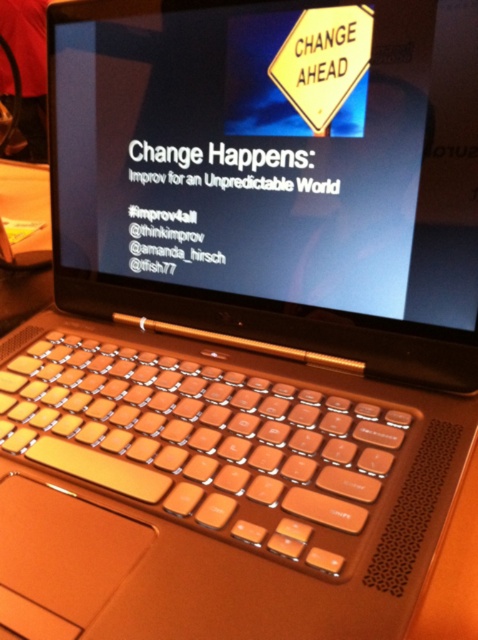
Consider the image. Which is more to the right, matte black laptop at center or orange plastic keyboard at center?

matte black laptop at center is more to the right.

Locate an element on the screen. The width and height of the screenshot is (478, 640). matte black laptop at center is located at coordinates (273, 152).

What do you see at coordinates (273, 152) in the screenshot?
I see `matte black laptop at center` at bounding box center [273, 152].

Find the location of a particular element. matte black laptop at center is located at coordinates (273, 152).